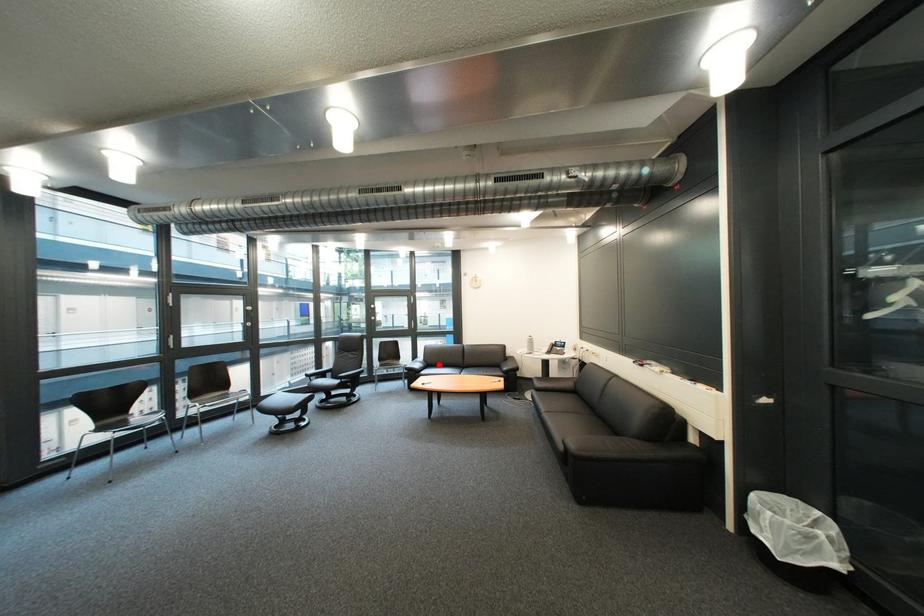
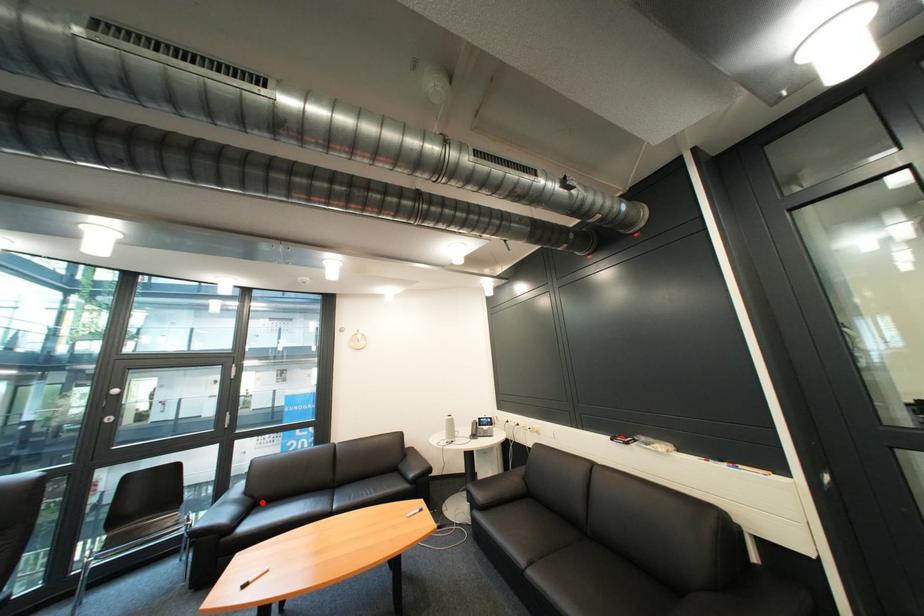
I am providing you with two images of the same scene from different viewpoints. A red point is marked on the first image and another point is marked on the second image. Are the points marked in image1 and image2 representing the same 3D position?

Yes